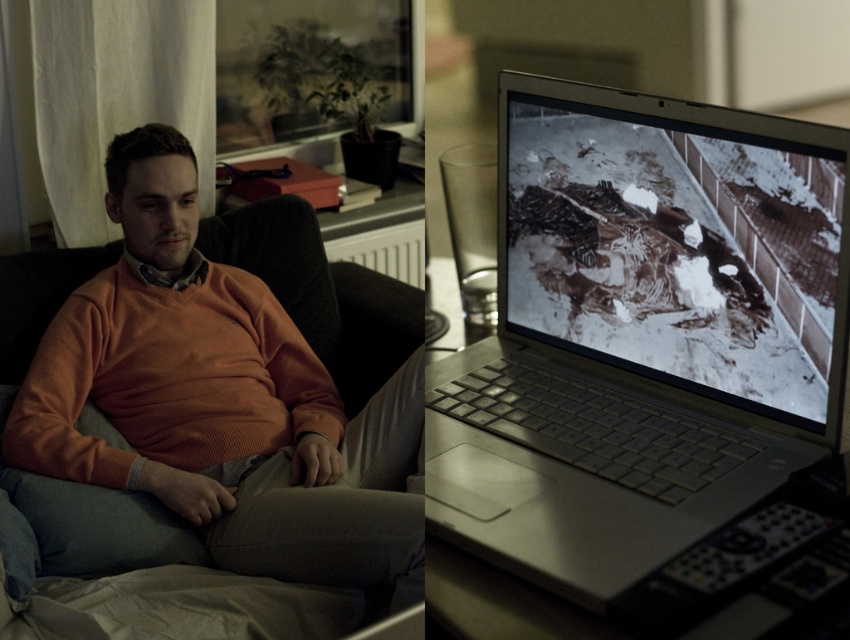
Question: Which point is closer to the camera?

Choices:
 (A) (82, 337)
 (B) (823, 433)

Answer: (B)

Question: Can you confirm if silver metallic laptop at center is positioned below orange knitted sweater at center?

Choices:
 (A) no
 (B) yes

Answer: (A)

Question: Which object appears closest to the camera in this image?

Choices:
 (A) silver metallic laptop at center
 (B) orange knitted sweater at center

Answer: (A)

Question: Does silver metallic laptop at center appear under orange knitted sweater at center?

Choices:
 (A) no
 (B) yes

Answer: (A)

Question: Is the position of silver metallic laptop at center more distant than that of orange knitted sweater at center?

Choices:
 (A) yes
 (B) no

Answer: (B)